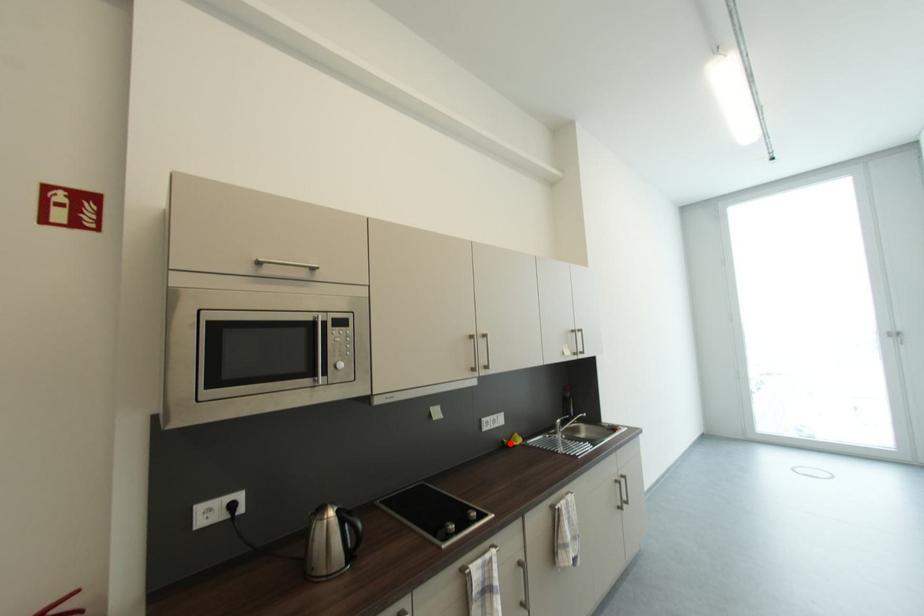
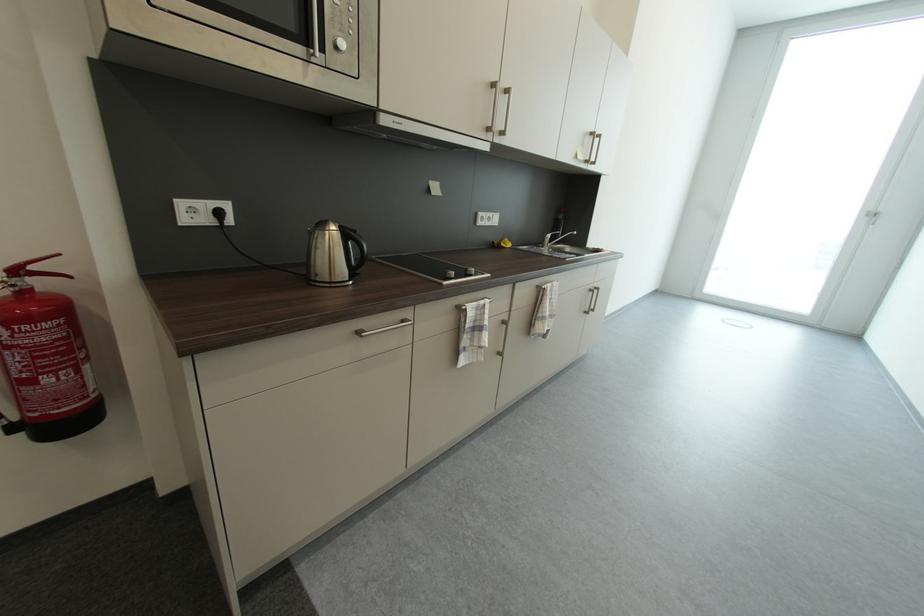
Locate, in the second image, the point that corresponds to the highlighted location in the first image.

(501, 244)